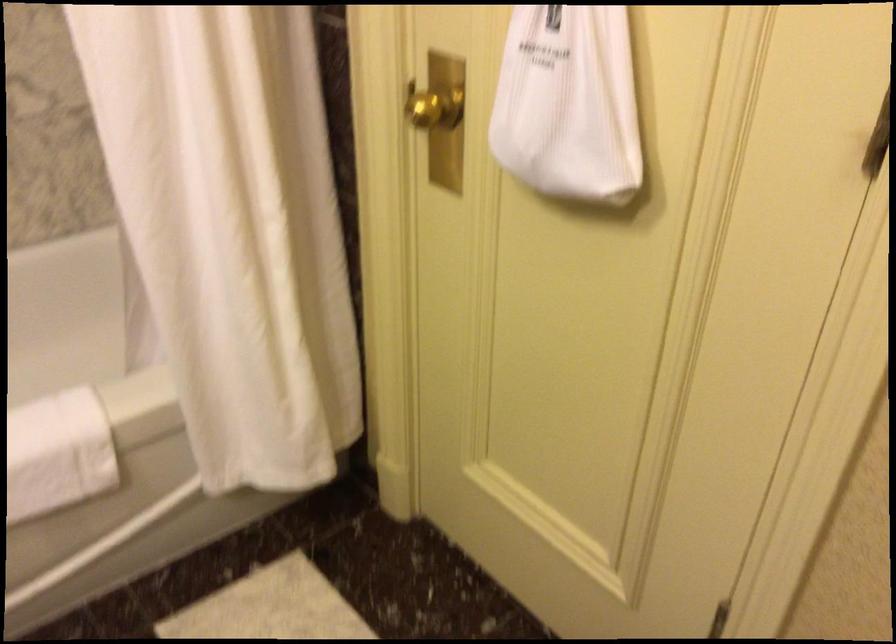
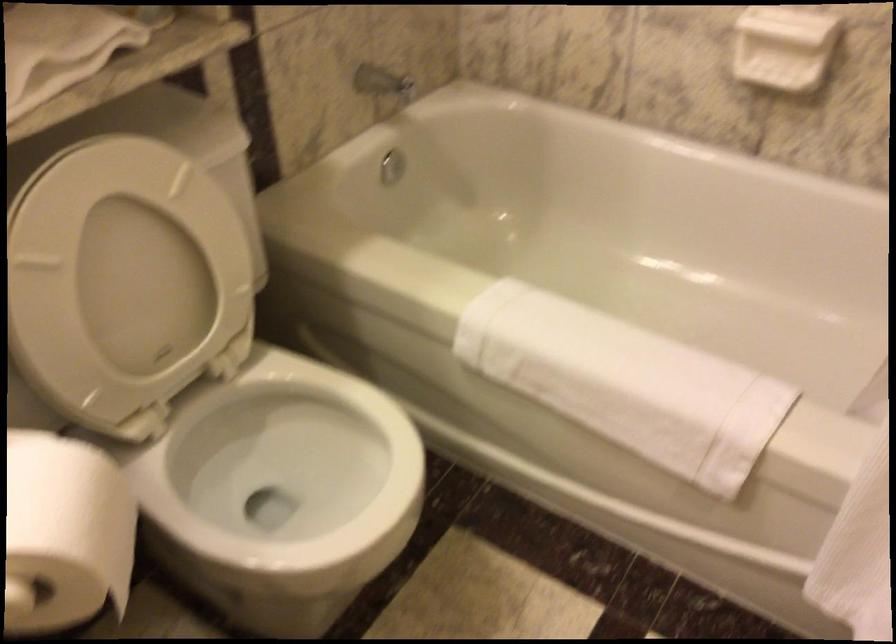
The images are taken continuously from a first-person perspective. In which direction is your viewpoint rotating?

The camera rotated toward left-down.